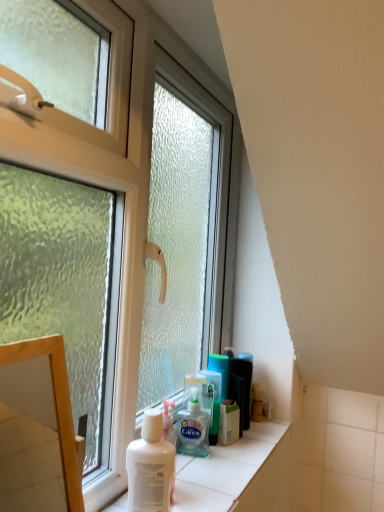
Question: Is wooden frame at left beside translucent plastic shaving cream at lower center, the first shaving cream viewed from the back?

Choices:
 (A) no
 (B) yes

Answer: (A)

Question: Is wooden frame at left far from translucent plastic shaving cream at lower center, positioned as the 2th shaving cream in front-to-back order?

Choices:
 (A) yes
 (B) no

Answer: (B)

Question: Considering the relative positions of wooden frame at left and translucent plastic shaving cream at lower center, the first shaving cream viewed from the back, in the image provided, is wooden frame at left behind translucent plastic shaving cream at lower center, the first shaving cream viewed from the back,?

Choices:
 (A) yes
 (B) no

Answer: (B)

Question: Is wooden frame at left positioned before translucent plastic shaving cream at lower center, positioned as the 2th shaving cream in front-to-back order?

Choices:
 (A) no
 (B) yes

Answer: (B)

Question: From the image's perspective, would you say wooden frame at left is shown under translucent plastic shaving cream at lower center, the first shaving cream viewed from the back?

Choices:
 (A) no
 (B) yes

Answer: (A)

Question: In the image, is translucent plastic shaving cream at lower center, positioned as the 2th shaving cream in front-to-back order, positioned in front of or behind white matte shaving cream at lower center, which is counted as the second shaving cream, starting from the back?

Choices:
 (A) front
 (B) behind

Answer: (B)

Question: Does point (187, 415) appear closer or farther from the camera than point (170, 456)?

Choices:
 (A) closer
 (B) farther

Answer: (B)

Question: In terms of height, does translucent plastic shaving cream at lower center, the first shaving cream viewed from the back, look taller or shorter compared to white matte shaving cream at lower center, the first shaving cream positioned from the front?

Choices:
 (A) tall
 (B) short

Answer: (B)

Question: From the image's perspective, is translucent plastic shaving cream at lower center, positioned as the 2th shaving cream in front-to-back order, above or below white matte shaving cream at lower center, which is counted as the second shaving cream, starting from the back?

Choices:
 (A) above
 (B) below

Answer: (B)

Question: From a real-world perspective, is white matte shaving cream at lower center, the first shaving cream positioned from the front, above or below translucent plastic shaving cream at lower center, the first shaving cream viewed from the back?

Choices:
 (A) above
 (B) below

Answer: (A)

Question: In the image, is white matte shaving cream at lower center, which is counted as the second shaving cream, starting from the back, positioned in front of or behind translucent plastic shaving cream at lower center, the first shaving cream viewed from the back?

Choices:
 (A) behind
 (B) front

Answer: (B)

Question: Based on their positions, is white matte shaving cream at lower center, which is counted as the second shaving cream, starting from the back, located to the left or right of translucent plastic shaving cream at lower center, positioned as the 2th shaving cream in front-to-back order?

Choices:
 (A) right
 (B) left

Answer: (B)

Question: From the image's perspective, is white matte shaving cream at lower center, which is counted as the second shaving cream, starting from the back, above or below translucent plastic shaving cream at lower center, the first shaving cream viewed from the back?

Choices:
 (A) above
 (B) below

Answer: (A)

Question: Is transparent glass window at center bigger or smaller than translucent plastic shaving cream at lower center, positioned as the 2th shaving cream in front-to-back order?

Choices:
 (A) small
 (B) big

Answer: (B)

Question: Looking at their shapes, would you say transparent glass window at center is wider or thinner than translucent plastic shaving cream at lower center, the first shaving cream viewed from the back?

Choices:
 (A) wide
 (B) thin

Answer: (A)